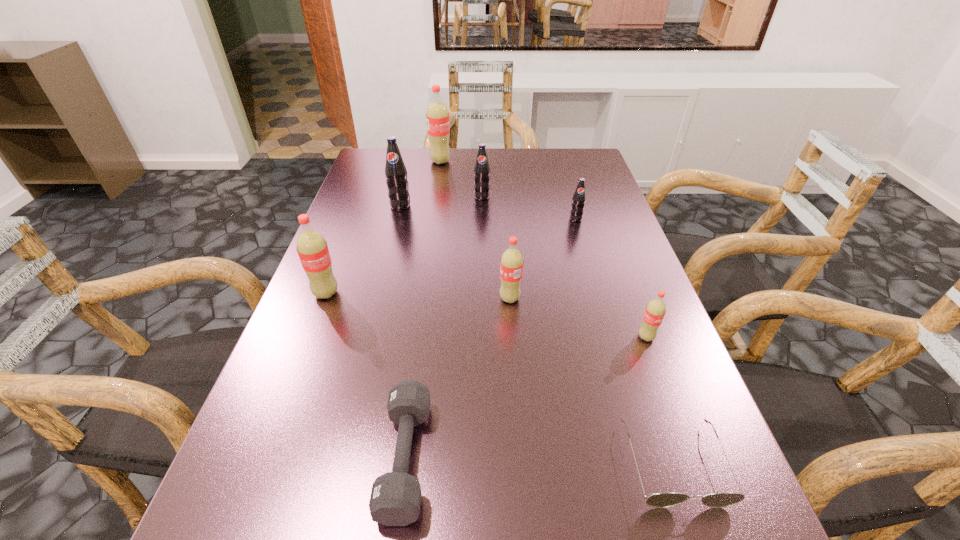
Where is `the sixth nearest object`? The image size is (960, 540). the sixth nearest object is located at coordinates (578, 200).

You are a GUI agent. You are given a task and a screenshot of the screen. Output one action in this format:
    pyautogui.click(x=<x>, y=<y>)
    Task: Click on the smallest black pop
    
    Given the screenshot: What is the action you would take?
    pyautogui.click(x=578, y=200)

Locate an element on the screen. the rightmost soda is located at coordinates (655, 310).

Find the location of a particular element. This screenshot has width=960, height=540. the rightmost red soda is located at coordinates (655, 310).

The image size is (960, 540). In order to click on gray dumbbell in this screenshot , I will do `click(395, 499)`.

The height and width of the screenshot is (540, 960). I want to click on the second shortest object, so tap(395, 499).

This screenshot has width=960, height=540. In order to click on sunglasses in this screenshot , I will do `click(666, 499)`.

This screenshot has width=960, height=540. I want to click on the shortest object, so click(x=666, y=499).

Where is `free space located 0.190m on the left of the third soda from left to right`? The height and width of the screenshot is (540, 960). free space located 0.190m on the left of the third soda from left to right is located at coordinates (370, 161).

Identify the location of free location located on the front label of the second object from left to right. The height and width of the screenshot is (540, 960). (388, 255).